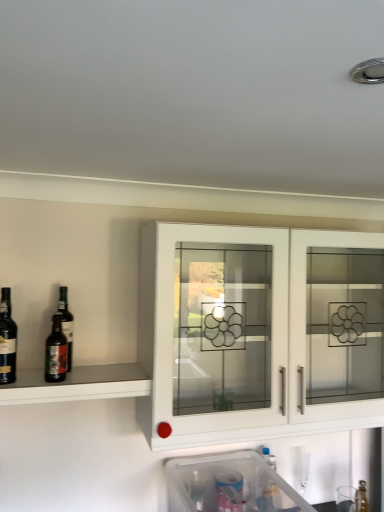
What is the approximate width of clear plastic container at lower center?

It is 19.27 inches.

The width and height of the screenshot is (384, 512). What do you see at coordinates (7, 340) in the screenshot?
I see `dark brown glass bottle at left, which appears as the 2th wine when viewed from the right` at bounding box center [7, 340].

Where is `white glossy cabinet at center`? Image resolution: width=384 pixels, height=512 pixels. white glossy cabinet at center is located at coordinates (258, 332).

Can you confirm if dark brown glass bottle at left, arranged as the first wine when viewed from the right, is positioned to the right of white glossy cabinet at center?

No.

Locate an element on the screen. This screenshot has height=512, width=384. cabinetry above the dark brown glass bottle at left, which is the second wine from left to right (from a real-world perspective) is located at coordinates (258, 332).

How much distance is there between dark brown glass bottle at left, arranged as the first wine when viewed from the right, and white glossy cabinet at center?

A distance of 28.81 inches exists between dark brown glass bottle at left, arranged as the first wine when viewed from the right, and white glossy cabinet at center.

From the image's perspective, between dark brown glass bottle at left, which appears as the 2th wine when viewed from the right, and white glossy cabinet at center, who is located below?

white glossy cabinet at center, from the image's perspective.

Can you tell me how much dark brown glass bottle at left, placed as the first wine when sorted from left to right, and white glossy cabinet at center differ in facing direction?

The angle between the facing direction of dark brown glass bottle at left, placed as the first wine when sorted from left to right, and the facing direction of white glossy cabinet at center is 0.000801 degrees.

Which is more to the right, dark brown glass bottle at left, which appears as the 2th wine when viewed from the right, or white glossy cabinet at center?

From the viewer's perspective, white glossy cabinet at center appears more on the right side.

From a real-world perspective, who is located higher, dark brown glass bottle at left, placed as the first wine when sorted from left to right, or white glossy cabinet at center?

dark brown glass bottle at left, placed as the first wine when sorted from left to right, from a real-world perspective.

Is dark brown glass bottle at left, which is the second wine from left to right, positioned beyond the bounds of matte glass shelf at left?

Yes, dark brown glass bottle at left, which is the second wine from left to right, is outside of matte glass shelf at left.

From a real-world perspective, which wine is the 1st one above the matte glass shelf at left? Please provide its 2D coordinates.

[(56, 352)]

Between clear plastic container at lower center and white glossy cabinet at center, which one has larger size?

white glossy cabinet at center.

Does point (250, 476) come closer to viewer compared to point (226, 374)?

Yes, it is.

How many degrees apart are the facing directions of clear plastic container at lower center and white glossy cabinet at center?

The facing directions of clear plastic container at lower center and white glossy cabinet at center are 0.503 degrees apart.

From the picture: Is clear glass bottle at lower right thinner than clear plastic container at lower center?

Indeed, clear glass bottle at lower right has a lesser width compared to clear plastic container at lower center.

Which point is more forward, (364, 494) or (220, 455)?

The point (220, 455) is closer to the camera.

Measure the distance between clear glass bottle at lower right and clear plastic container at lower center.

A distance of 28.00 inches exists between clear glass bottle at lower right and clear plastic container at lower center.

In order to click on dish washer above the clear glass bottle at lower right (from the image's perspective) in this screenshot , I will do `click(229, 485)`.

Does point (163, 289) appear closer or farther from the camera than point (53, 367)?

Clearly, point (163, 289) is closer to the camera than point (53, 367).

Does white glossy cabinet at center have a smaller size compared to dark brown glass bottle at left, arranged as the first wine when viewed from the right?

Incorrect, white glossy cabinet at center is not smaller in size than dark brown glass bottle at left, arranged as the first wine when viewed from the right.

From a real-world perspective, relative to dark brown glass bottle at left, arranged as the first wine when viewed from the right, is white glossy cabinet at center vertically above or below?

From a real-world perspective, white glossy cabinet at center is physically above dark brown glass bottle at left, arranged as the first wine when viewed from the right.

Considering the sizes of objects white glossy cabinet at center and dark brown glass bottle at left, arranged as the first wine when viewed from the right, in the image provided, who is wider, white glossy cabinet at center or dark brown glass bottle at left, arranged as the first wine when viewed from the right,?

With larger width is white glossy cabinet at center.

From the image's perspective, which object appears higher, matte glass shelf at left or white glossy cabinet at center?

white glossy cabinet at center appears higher in the image.

Considering the relative sizes of matte glass shelf at left and white glossy cabinet at center in the image provided, is matte glass shelf at left thinner than white glossy cabinet at center?

Yes, matte glass shelf at left is thinner than white glossy cabinet at center.

From a real-world perspective, does matte glass shelf at left stand above white glossy cabinet at center?

No, from a real-world perspective, matte glass shelf at left is not above white glossy cabinet at center.

Where is `wine below the white glossy cabinet at center (from a real-world perspective)`? Image resolution: width=384 pixels, height=512 pixels. wine below the white glossy cabinet at center (from a real-world perspective) is located at coordinates (56, 352).

The image size is (384, 512). I want to click on cabinetry behind the dark brown glass bottle at left, placed as the first wine when sorted from left to right, so click(x=258, y=332).

Which object lies nearer to the anchor point dark brown glass bottle at left, which appears as the 2th wine when viewed from the right, white glossy cabinet at center or matte glass shelf at left?

Based on the image, matte glass shelf at left appears to be nearer to dark brown glass bottle at left, which appears as the 2th wine when viewed from the right.

Looking at the image, which one is located closer to clear glass bottle at lower right, dark brown glass bottle at left, which is the second wine from left to right, or matte glass shelf at left?

matte glass shelf at left.

Which object lies further to the anchor point dark brown glass bottle at left, arranged as the first wine when viewed from the right, white glossy cabinet at center or dark brown glass bottle at left, placed as the first wine when sorted from left to right?

white glossy cabinet at center is further to dark brown glass bottle at left, arranged as the first wine when viewed from the right.

Considering their positions, is white glossy cabinet at center positioned closer to clear glass bottle at lower right than dark brown glass bottle at left, arranged as the first wine when viewed from the right?

white glossy cabinet at center is closer to clear glass bottle at lower right.

In the scene shown: Based on their spatial positions, is clear plastic container at lower center or dark brown glass bottle at left, which appears as the 2th wine when viewed from the right, closer to matte glass shelf at left?

dark brown glass bottle at left, which appears as the 2th wine when viewed from the right, is positioned closer to the anchor matte glass shelf at left.

From the image, which object appears to be farther from dark brown glass bottle at left, placed as the first wine when sorted from left to right, dark brown glass bottle at left, arranged as the first wine when viewed from the right, or matte glass shelf at left?

Based on the image, matte glass shelf at left appears to be further to dark brown glass bottle at left, placed as the first wine when sorted from left to right.

Based on their spatial positions, is dark brown glass bottle at left, arranged as the first wine when viewed from the right, or clear glass bottle at lower right closer to clear plastic container at lower center?

clear glass bottle at lower right is positioned closer to the anchor clear plastic container at lower center.

Estimate the real-world distances between objects in this image. Which object is closer to matte glass shelf at left, clear plastic container at lower center or clear glass bottle at lower right?

clear plastic container at lower center is closer to matte glass shelf at left.

The height and width of the screenshot is (512, 384). What are the coordinates of `shelf located between dark brown glass bottle at left, placed as the first wine when sorted from left to right, and clear glass bottle at lower right in the left-right direction` in the screenshot? It's located at (77, 384).

Find the location of a particular element. The width and height of the screenshot is (384, 512). wine between dark brown glass bottle at left, which appears as the 2th wine when viewed from the right, and white glossy cabinet at center from left to right is located at coordinates (56, 352).

This screenshot has width=384, height=512. I want to click on shelf between dark brown glass bottle at left, which appears as the 2th wine when viewed from the right, and clear plastic container at lower center from left to right, so [77, 384].

Locate an element on the screen. Image resolution: width=384 pixels, height=512 pixels. cabinetry located between dark brown glass bottle at left, which is the second wine from left to right, and clear glass bottle at lower right in the left-right direction is located at coordinates (258, 332).